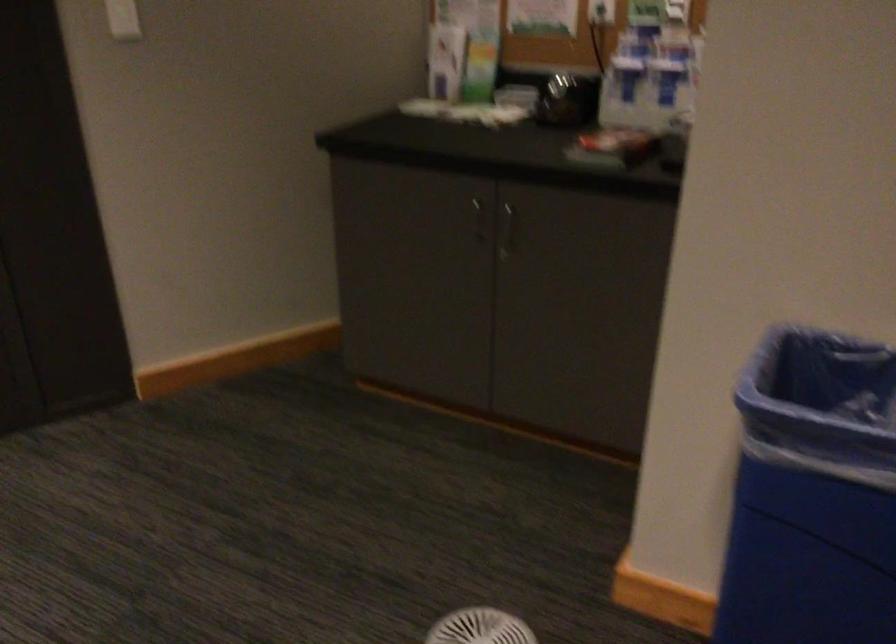
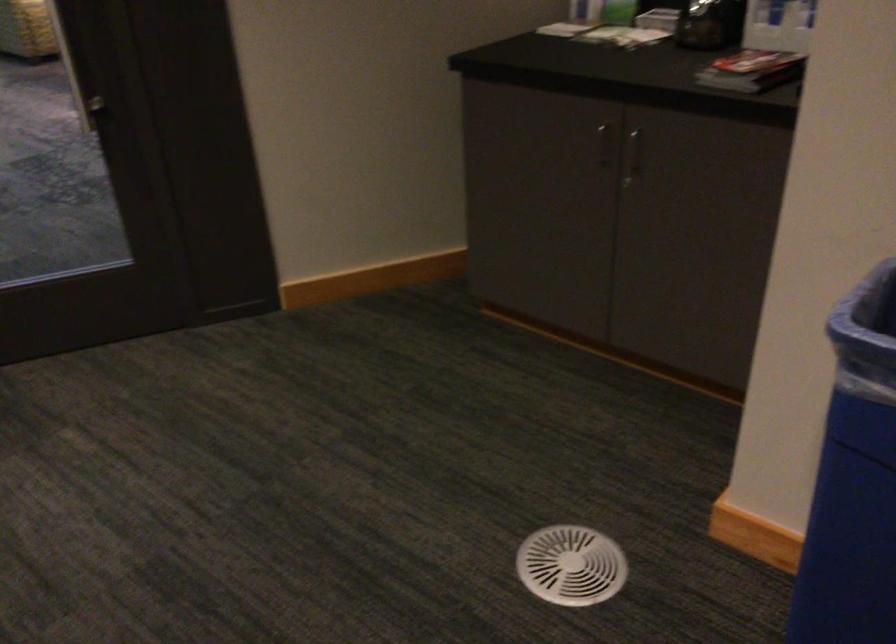
Where in the second image is the point corresponding to pixel 512 229 from the first image?

(633, 155)